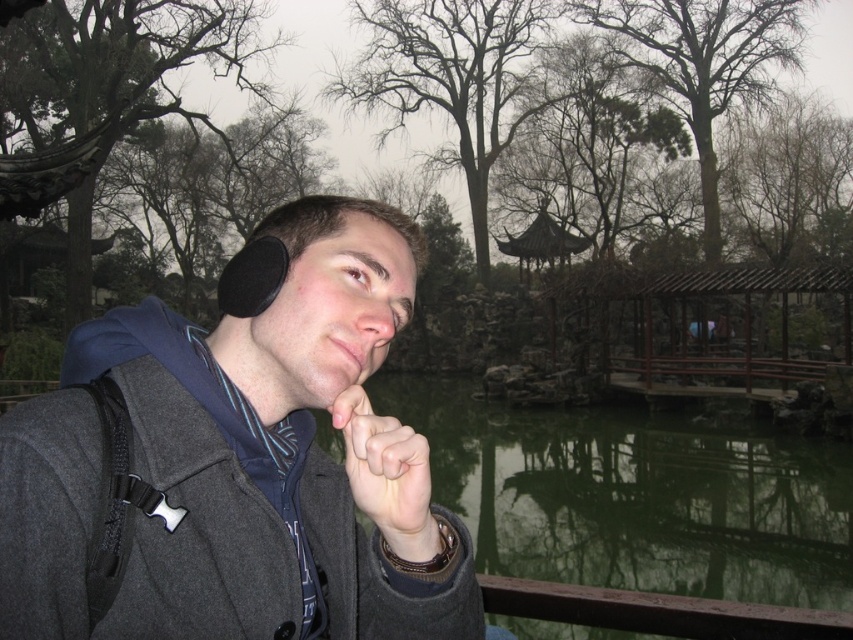
Is the position of green reflective water at center more distant than that of skinny white hand at center?

Yes, green reflective water at center is behind skinny white hand at center.

Which of these two, green reflective water at center or skinny white hand at center, stands shorter?

skinny white hand at center

This screenshot has width=853, height=640. What do you see at coordinates (635, 497) in the screenshot?
I see `green reflective water at center` at bounding box center [635, 497].

Identify the location of green reflective water at center. (635, 497).

Can you confirm if green reflective water at center is wider than wooden gazebo at center?

Correct, the width of green reflective water at center exceeds that of wooden gazebo at center.

Does green reflective water at center appear on the left side of wooden gazebo at center?

Correct, you'll find green reflective water at center to the left of wooden gazebo at center.

You are a GUI agent. You are given a task and a screenshot of the screen. Output one action in this format:
    pyautogui.click(x=<x>, y=<y>)
    Task: Click on the green reflective water at center
    
    Given the screenshot: What is the action you would take?
    pyautogui.click(x=635, y=497)

Who is taller, dark gray wool jacket at center or green reflective water at center?

green reflective water at center is taller.

From the picture: Between dark gray wool jacket at center and green reflective water at center, which one is positioned higher?

dark gray wool jacket at center

Between point (119, 353) and point (556, 476), which one is positioned in front?

Point (119, 353) is in front.

At what (x,y) coordinates should I click in order to perform the action: click on dark gray wool jacket at center. Please return your answer as a coordinate pair (x, y). This screenshot has width=853, height=640. Looking at the image, I should click on (238, 465).